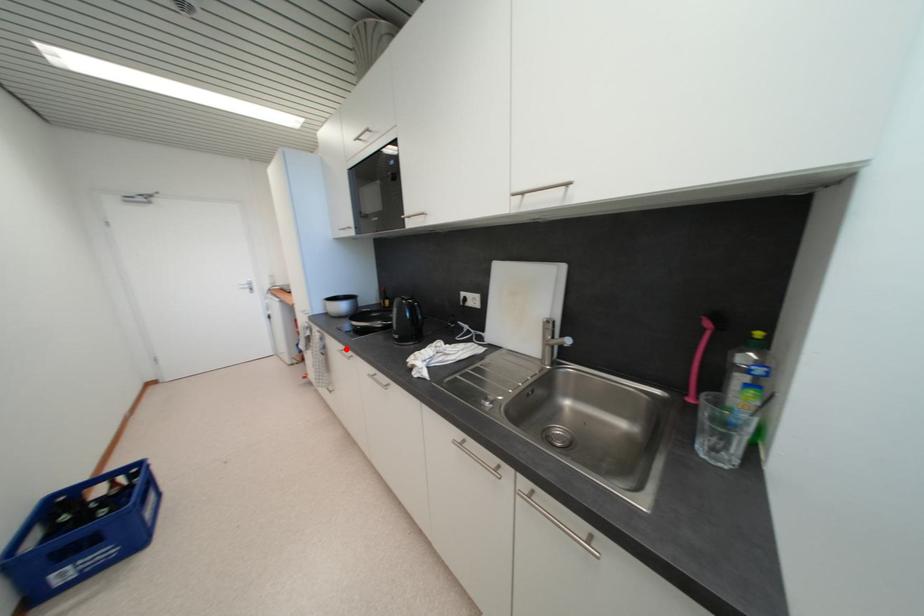
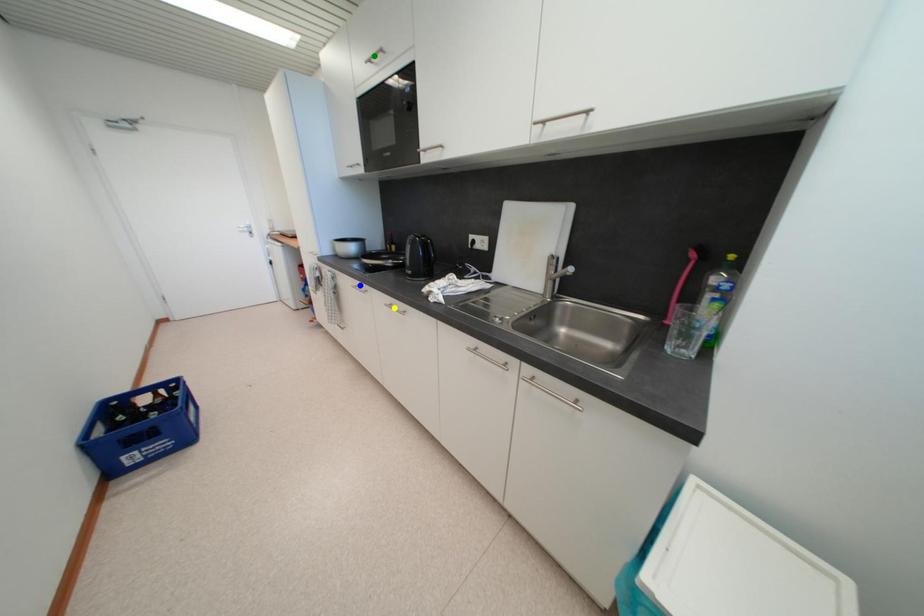
Question: I am providing you with two images of the same scene from different viewpoints. A red point is marked on the first image. You are given multiple points on the second image. In image 2, which mark is for the same physical point as the one in image 1?

Choices:
 (A) blue point
 (B) yellow point
 (C) green point

Answer: (A)